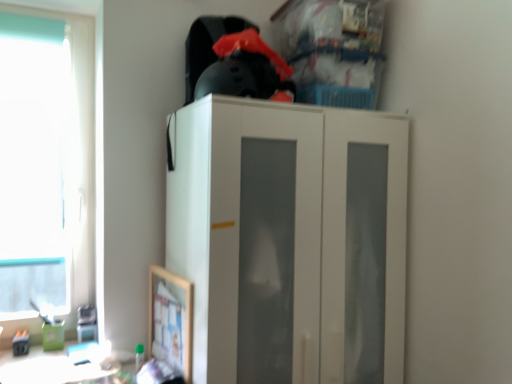
Question: Is point (317, 185) positioned closer to the camera than point (79, 29)?

Choices:
 (A) farther
 (B) closer

Answer: (B)

Question: Considering their positions, is white matte cabinet at center located in front of or behind transparent glass window at left?

Choices:
 (A) behind
 (B) front

Answer: (B)

Question: Considering the positions of white matte cabinet at center and transparent glass window at left in the image, is white matte cabinet at center bigger or smaller than transparent glass window at left?

Choices:
 (A) big
 (B) small

Answer: (A)

Question: From the image's perspective, is transparent glass window at left positioned above or below white matte cabinet at center?

Choices:
 (A) above
 (B) below

Answer: (A)

Question: Is point (72, 152) closer or farther from the camera than point (306, 145)?

Choices:
 (A) closer
 (B) farther

Answer: (B)

Question: Looking at their shapes, would you say transparent glass window at left is wider or thinner than white matte cabinet at center?

Choices:
 (A) thin
 (B) wide

Answer: (A)

Question: Looking at the image, does transparent glass window at left seem bigger or smaller compared to white matte cabinet at center?

Choices:
 (A) big
 (B) small

Answer: (B)